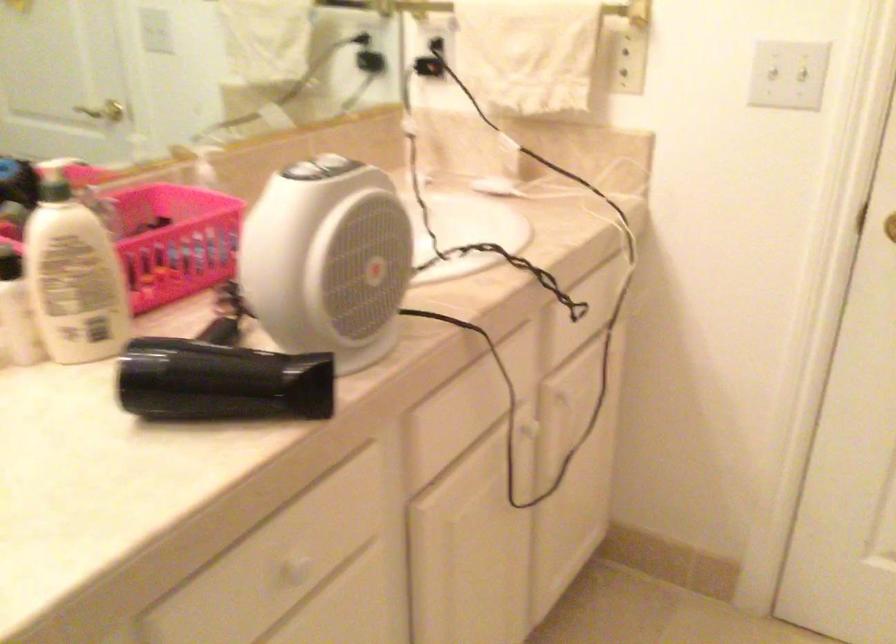
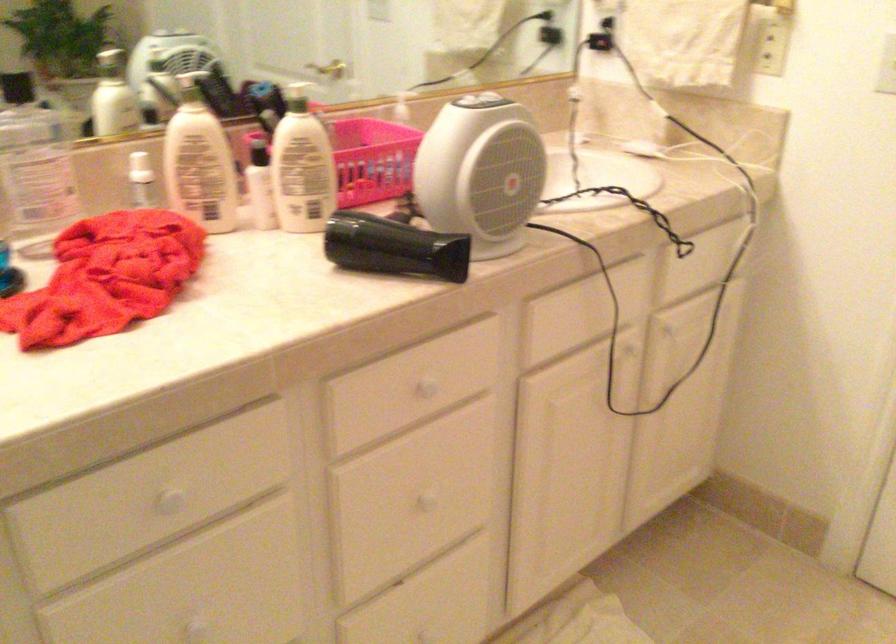
Find the pixel in the second image that matches (242,377) in the first image.

(393, 247)